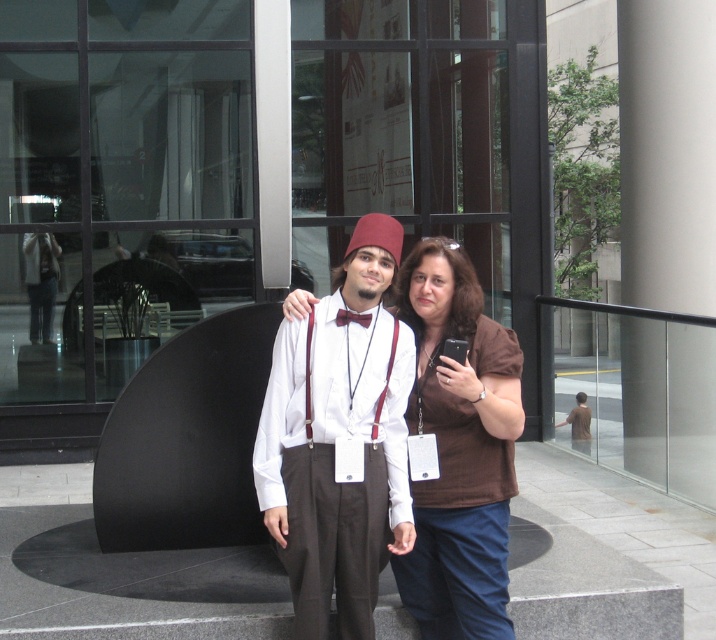
Question: Which point is farther to the camera?

Choices:
 (A) (396, 563)
 (B) (324, 348)

Answer: (A)

Question: Which of the following is the farthest from the observer?

Choices:
 (A) (425, 544)
 (B) (337, 284)

Answer: (A)

Question: Can you confirm if white matte shirt at center is positioned above brown fabric shirt at center?

Choices:
 (A) yes
 (B) no

Answer: (A)

Question: Can you confirm if white matte shirt at center is positioned below brown fabric shirt at center?

Choices:
 (A) no
 (B) yes

Answer: (A)

Question: Is white matte shirt at center above brown fabric shirt at center?

Choices:
 (A) no
 (B) yes

Answer: (B)